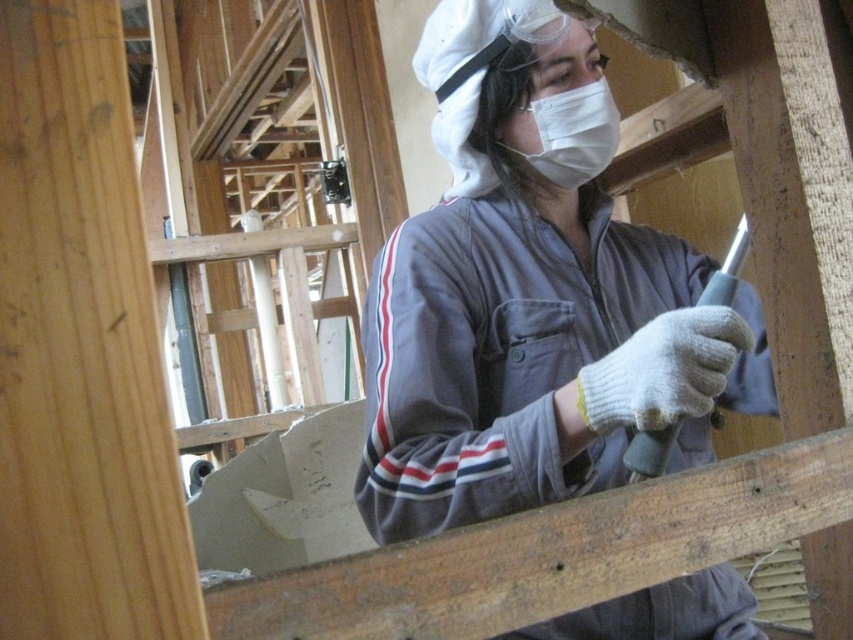
Question: Which point is farther to the camera?

Choices:
 (A) white fabric mask at center
 (B) gray fabric at center

Answer: (A)

Question: Is gray fabric at center smaller than white fabric mask at center?

Choices:
 (A) yes
 (B) no

Answer: (B)

Question: Which point is closer to the camera?

Choices:
 (A) (595, 88)
 (B) (732, 372)

Answer: (A)

Question: Can you confirm if gray fabric at center is positioned to the right of white fabric mask at center?

Choices:
 (A) no
 (B) yes

Answer: (B)

Question: Can you confirm if gray fabric at center is positioned to the left of white fabric mask at center?

Choices:
 (A) no
 (B) yes

Answer: (A)